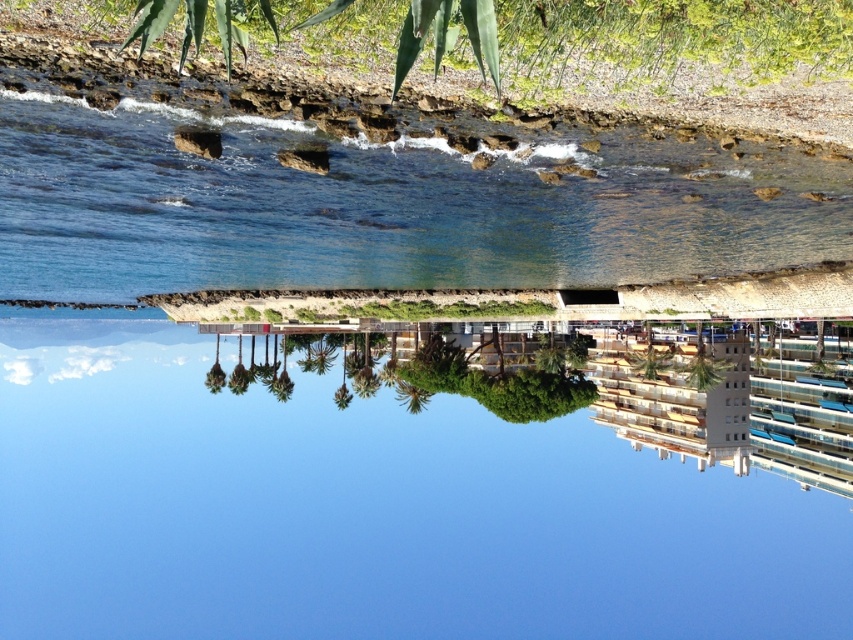
Question: Observing the image, what is the correct spatial positioning of blue glass river at center in reference to clear blue water at center?

Choices:
 (A) below
 (B) above

Answer: (A)

Question: Is blue glass river at center wider than clear blue water at center?

Choices:
 (A) no
 (B) yes

Answer: (B)

Question: Does blue glass river at center appear on the right side of clear blue water at center?

Choices:
 (A) yes
 (B) no

Answer: (B)